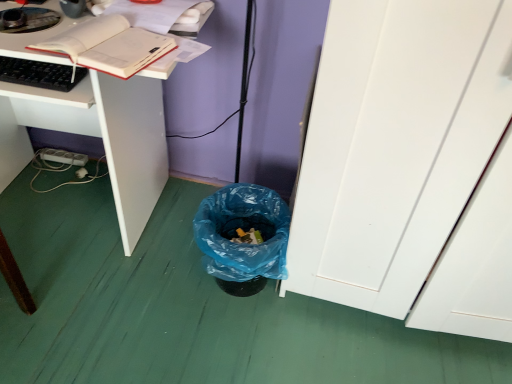
Where is `free region on the left part of blue plastic trash can at lower center`? The image size is (512, 384). free region on the left part of blue plastic trash can at lower center is located at coordinates (159, 271).